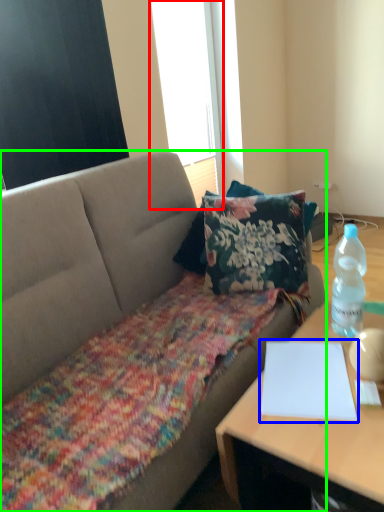
Question: Considering the real-world distances, which object is farthest from window screen (highlighted by a red box)? notebook (highlighted by a blue box) or studio couch (highlighted by a green box)?

Choices:
 (A) notebook
 (B) studio couch

Answer: (A)